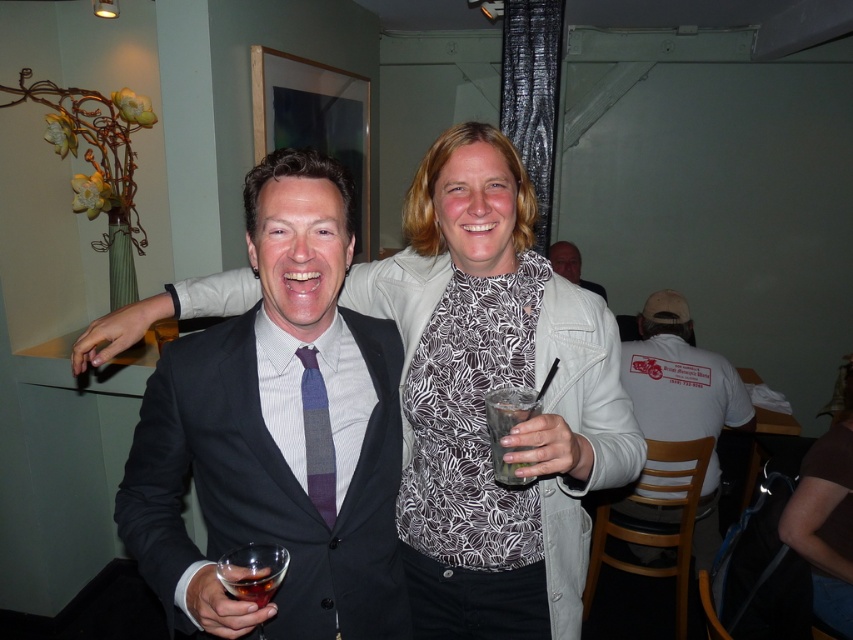
You are a photographer at the event and want to capture a photo that includes both the matte black suit at center and the white matte jacket at upper center. Based on their positions, which one should you focus on first to ensure both are in frame?

The matte black suit at center is positioned under the white matte jacket at upper center, so you should focus on the white matte jacket at upper center first to ensure both are in frame.